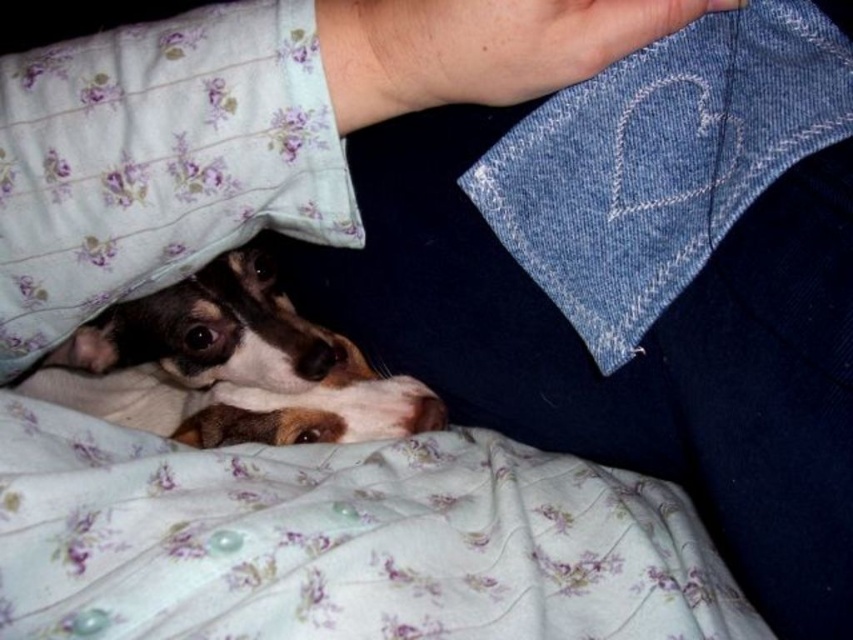
Question: Does fluffy white pillow at upper left lie in front of denim at upper center?

Choices:
 (A) no
 (B) yes

Answer: (A)

Question: Which is farther from the fluffy white pillow at upper left?

Choices:
 (A) denim at upper center
 (B) fluffy white blanket at lower left

Answer: (A)

Question: Considering the real-world distances, which object is farthest from the fluffy white blanket at lower left?

Choices:
 (A) denim at upper center
 (B) brown and white fur at center

Answer: (A)

Question: Does denim at upper center appear over brown and white fur at center?

Choices:
 (A) yes
 (B) no

Answer: (A)

Question: Which point is closer to the camera?

Choices:
 (A) fluffy white pillow at upper left
 (B) fluffy white blanket at lower left
 (C) denim at upper center
 (D) brown and white fur at center

Answer: (B)

Question: Can you confirm if fluffy white blanket at lower left is positioned to the right of denim at upper center?

Choices:
 (A) yes
 (B) no

Answer: (B)